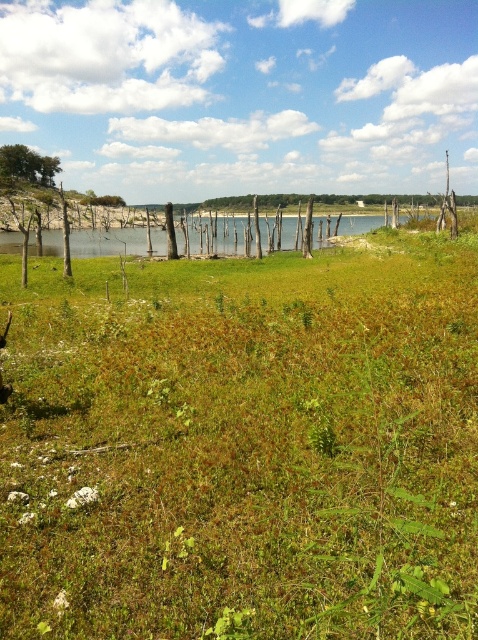
Question: Is green grassy at center to the left of green leafy tree at upper left from the viewer's perspective?

Choices:
 (A) no
 (B) yes

Answer: (A)

Question: Which object appears farthest from the camera in this image?

Choices:
 (A) green leafy tree at upper left
 (B) green grassy at center

Answer: (A)

Question: Does green grassy at center appear under green leafy tree at upper left?

Choices:
 (A) yes
 (B) no

Answer: (A)

Question: Considering the relative positions of green grassy at center and green leafy tree at upper left in the image provided, where is green grassy at center located with respect to green leafy tree at upper left?

Choices:
 (A) below
 (B) above

Answer: (A)